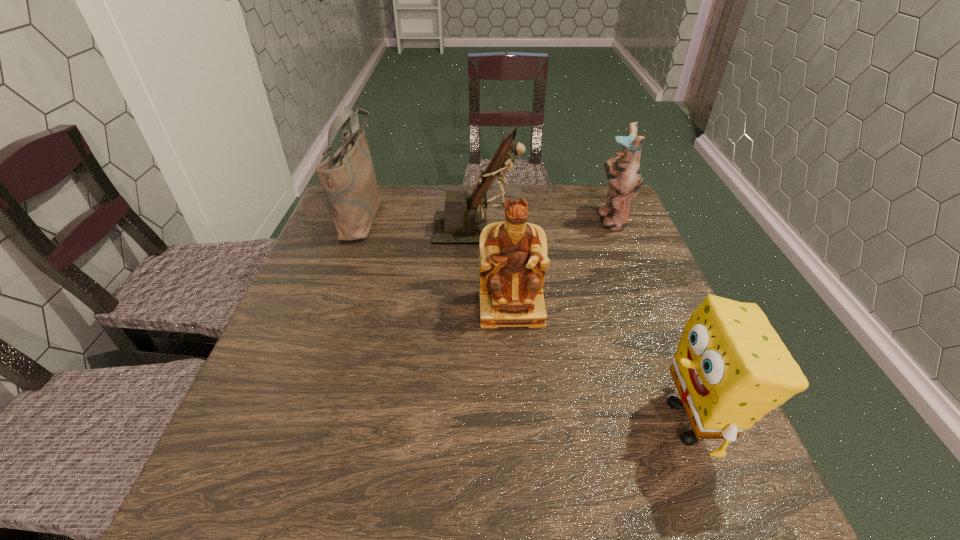
At what (x,y) coordinates should I click in order to perform the action: click on free space that satisfies the following two spatial constraints: 1. on the front-facing side of the rightmost figurine; 2. on the front-facing side of the fourth farthest object. Please return your answer as a coordinate pair (x, y). Looking at the image, I should click on (647, 308).

Find the location of a particular element. This screenshot has height=540, width=960. free point that satisfies the following two spatial constraints: 1. on the front-facing side of the rightmost figurine; 2. on the front-facing side of the nearest figurine is located at coordinates (647, 308).